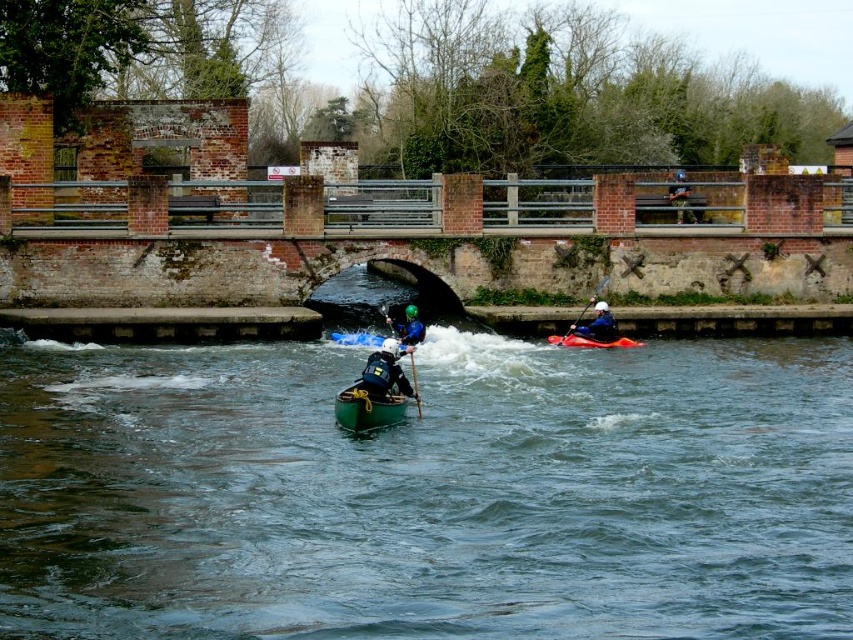
Question: Does green rubber boat at center appear on the right side of matte blue helmet at center?

Choices:
 (A) no
 (B) yes

Answer: (A)

Question: Does green rubber boat at center appear under orange plastic paddle at right?

Choices:
 (A) yes
 (B) no

Answer: (A)

Question: Which point is farther from the camera taking this photo?

Choices:
 (A) (608, 346)
 (B) (49, 582)
 (C) (561, 337)
 (D) (422, 324)

Answer: (C)

Question: Is green rubber boat at center above green matte canoe at center?

Choices:
 (A) yes
 (B) no

Answer: (B)

Question: Which of the following is the farthest from the observer?

Choices:
 (A) pos(410,326)
 (B) pos(576,330)
 (C) pos(399,353)
 (D) pos(375,419)

Answer: (B)

Question: Which of the following is the closest to the observer?

Choices:
 (A) (583, 337)
 (B) (358, 381)
 (C) (596, 310)

Answer: (B)